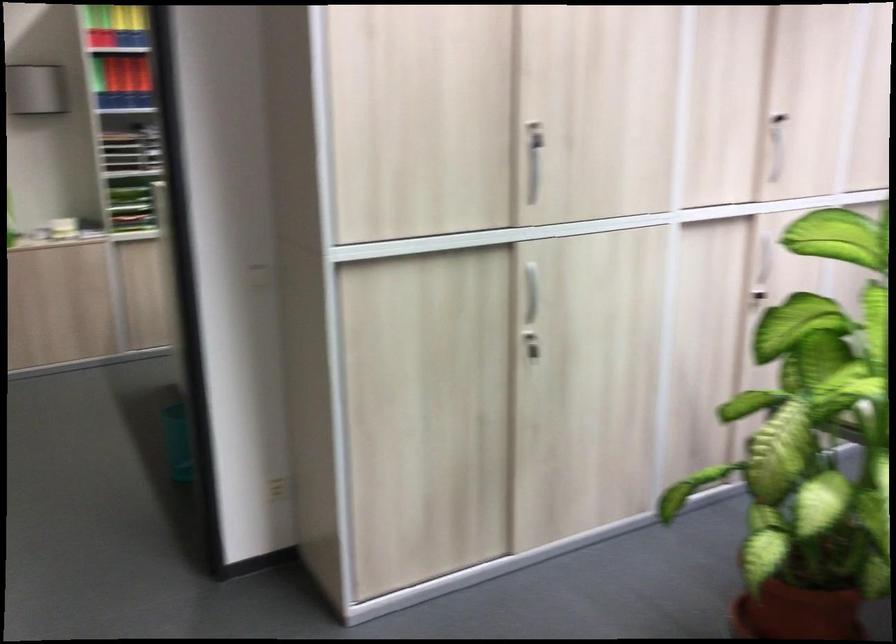
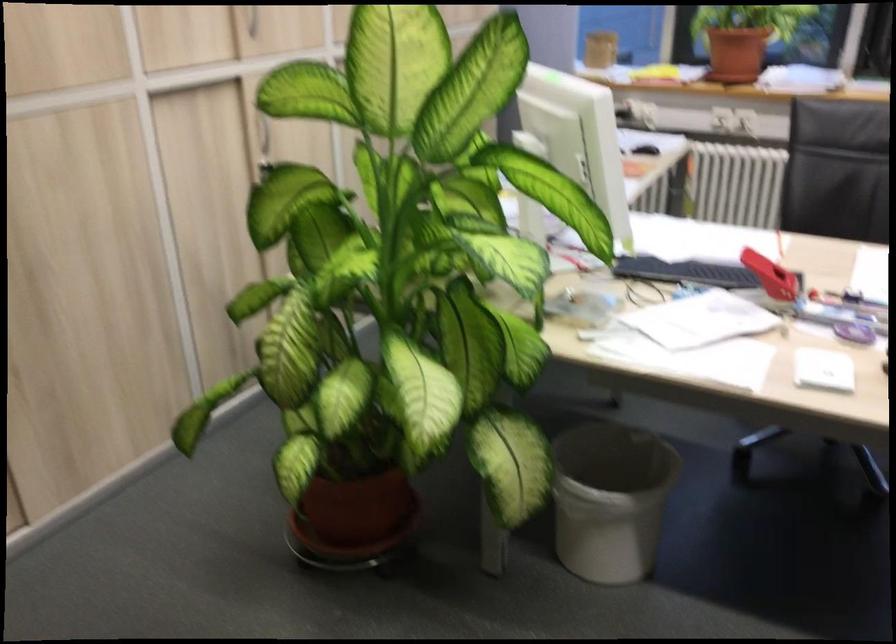
Question: The first image is from the beginning of the video and the second image is from the end. How did the camera likely rotate when shooting the video?

Choices:
 (A) Left
 (B) Right
 (C) Up
 (D) Down

Answer: (B)